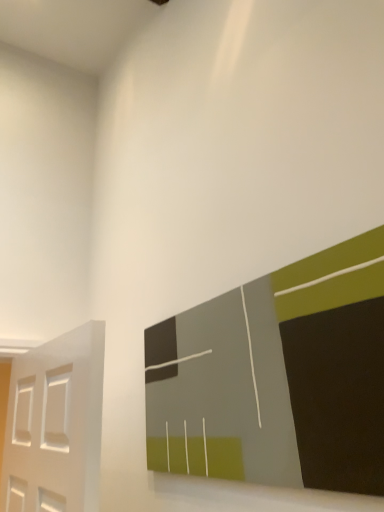
The height and width of the screenshot is (512, 384). What do you see at coordinates (277, 377) in the screenshot? I see `matte black bulletin board at center` at bounding box center [277, 377].

At what (x,y) coordinates should I click in order to perform the action: click on matte black bulletin board at center. Please return your answer as a coordinate pair (x, y). The image size is (384, 512). Looking at the image, I should click on (277, 377).

This screenshot has height=512, width=384. In order to click on matte black bulletin board at center in this screenshot , I will do `click(277, 377)`.